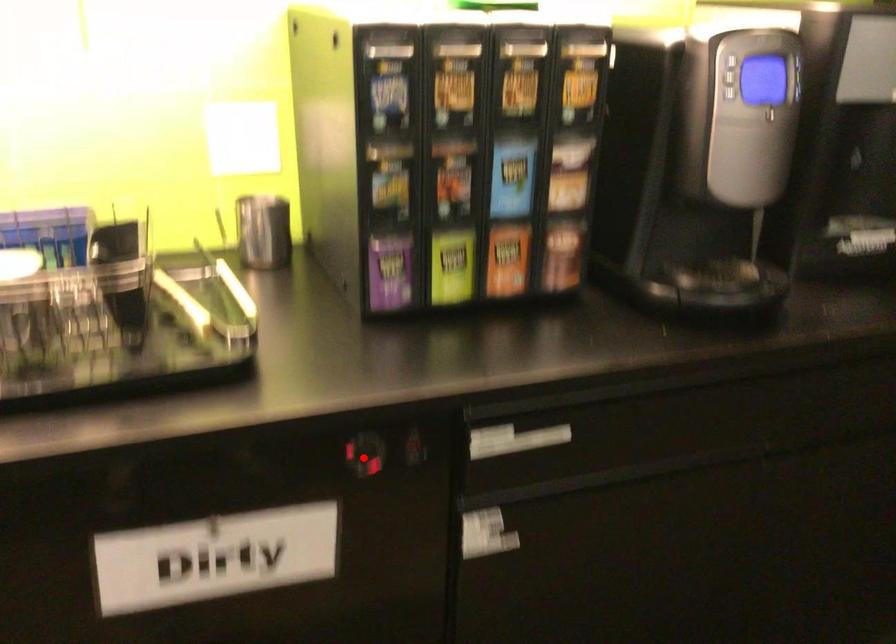
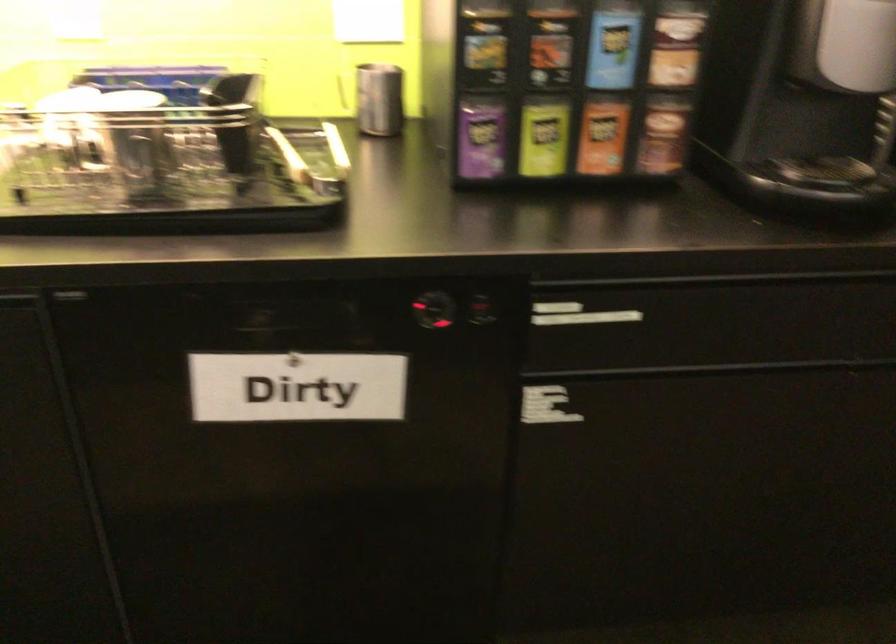
In the second image, find the point that corresponds to the highlighted location in the first image.

(433, 310)